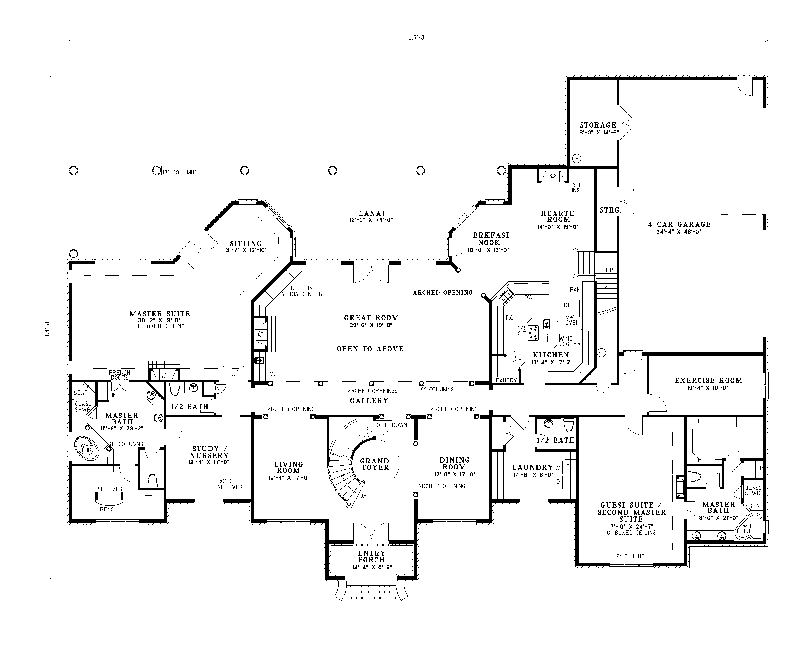
The height and width of the screenshot is (671, 800). Identify the location of exercise room. [650, 358], [646, 413], [761, 413], [760, 353].